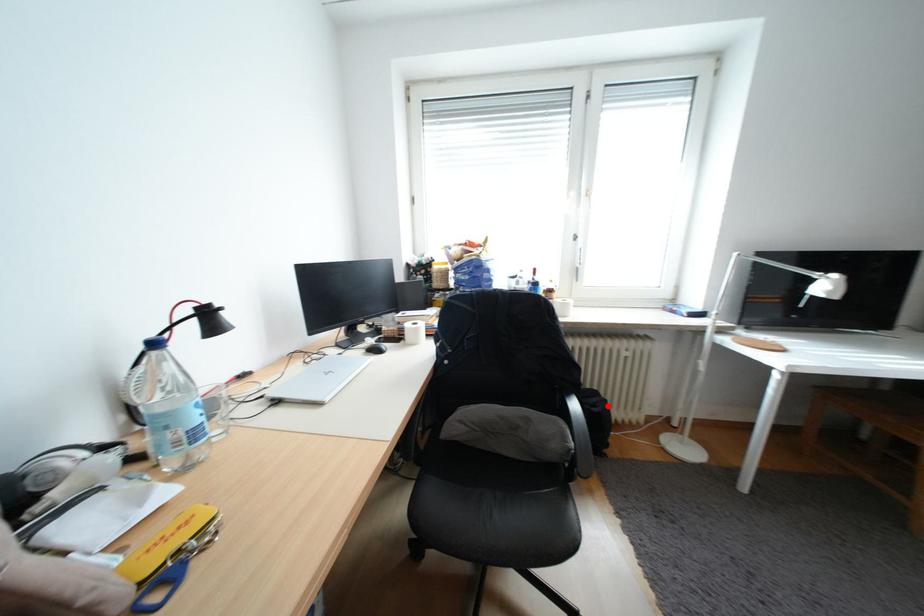
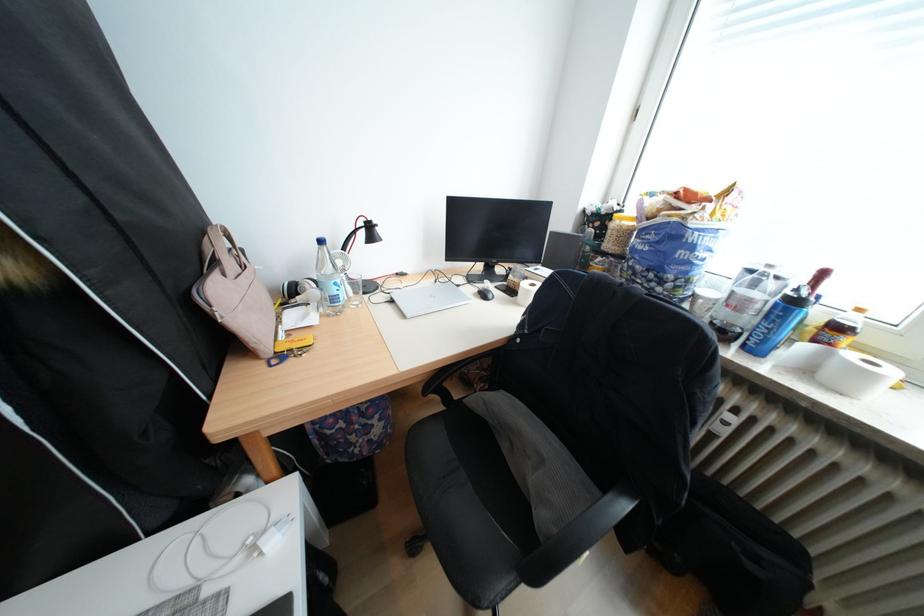
Locate, in the second image, the point that corresponds to the highlighted location in the first image.

(771, 561)